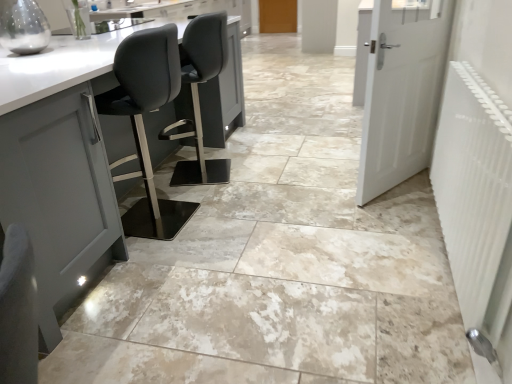
Image resolution: width=512 pixels, height=384 pixels. What are the coordinates of `vacant region in front of white matte door at right, which is the 2th door from top to bottom` in the screenshot? It's located at (392, 215).